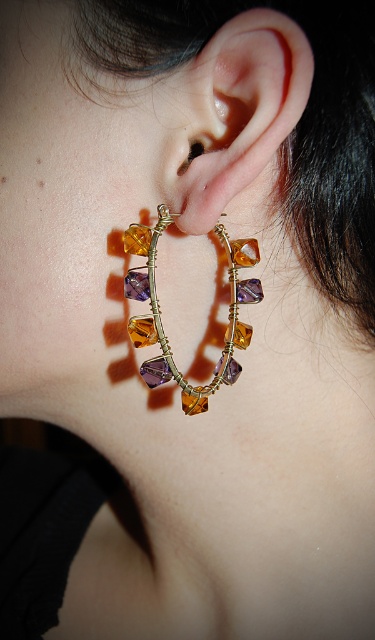
Does clear crystal earring at center have a greater width compared to amber-gold wire hoop at ear?

In fact, clear crystal earring at center might be narrower than amber-gold wire hoop at ear.

Find the location of a particular element. The width and height of the screenshot is (375, 640). clear crystal earring at center is located at coordinates (249, 108).